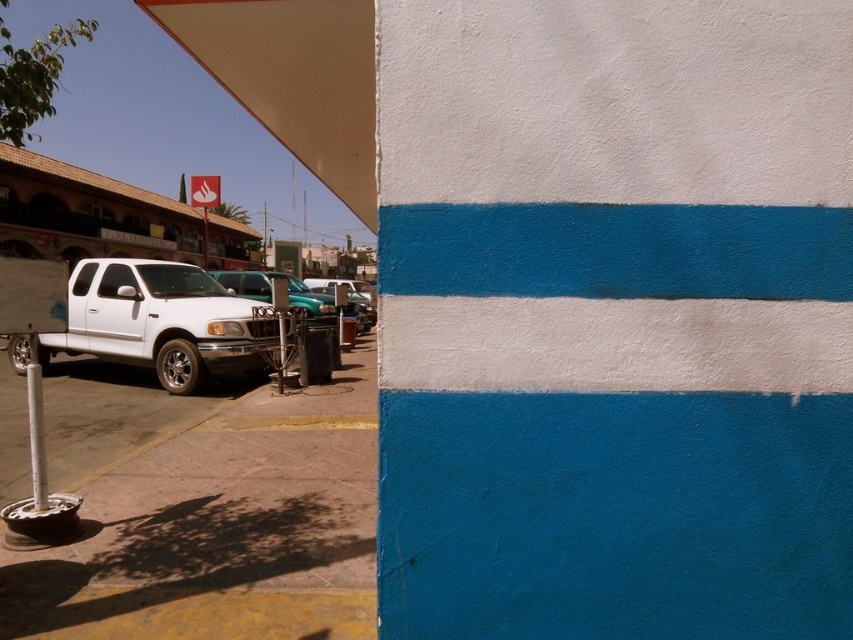
Does point (186, 339) lie behind point (9, 337)?

Yes.

Which is in front, point (166, 372) or point (25, 356)?

Positioned in front is point (166, 372).

In order to click on shiny silver tire at lower left in this screenshot , I will do `click(178, 365)`.

Is metallic teal sedan at center to the right of shiny silver tire at lower left from the viewer's perspective?

In fact, metallic teal sedan at center is to the left of shiny silver tire at lower left.

Describe the element at coordinates (270, 291) in the screenshot. I see `metallic teal sedan at center` at that location.

At what (x,y) coordinates should I click in order to perform the action: click on metallic teal sedan at center. Please return your answer as a coordinate pair (x, y). The width and height of the screenshot is (853, 640). Looking at the image, I should click on (270, 291).

The height and width of the screenshot is (640, 853). Find the location of `matte white pickup truck at left`. matte white pickup truck at left is located at coordinates (158, 321).

Is matte white pickup truck at left closer to camera compared to white painted metal pole at lower left?

No, matte white pickup truck at left is behind white painted metal pole at lower left.

Is point (39, 333) closer to camera compared to point (33, 352)?

That is True.

The width and height of the screenshot is (853, 640). Find the location of `matte white pickup truck at left`. matte white pickup truck at left is located at coordinates (158, 321).